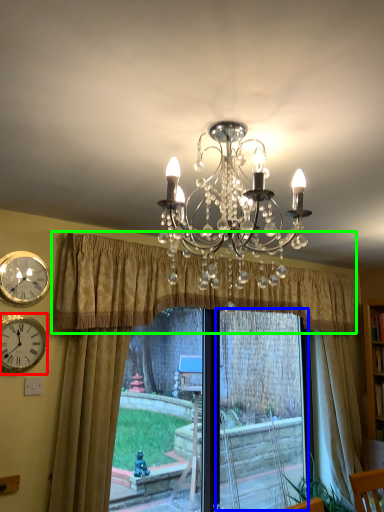
Question: Which object is positioned closest to wall clock (highlighted by a red box)? Select from window frame (highlighted by a blue box) and curtain (highlighted by a green box).

Choices:
 (A) window frame
 (B) curtain

Answer: (B)